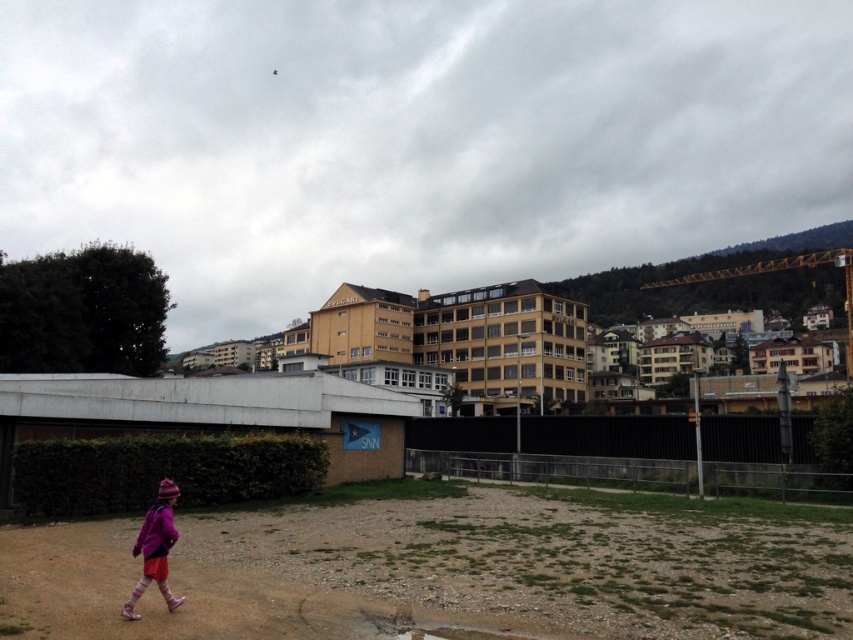
Who is lower down, brown gravel field at lower left or white concrete overpass at center?

brown gravel field at lower left is lower down.

Between point (234, 611) and point (328, 404), which one is positioned in front?

Point (234, 611) is in front.

I want to click on brown gravel field at lower left, so click(x=450, y=570).

Can you confirm if brown gravel field at lower left is bigger than pink woolen hat at lower left?

Yes.

Which is above, brown gravel field at lower left or pink woolen hat at lower left?

Positioned higher is pink woolen hat at lower left.

Is point (590, 502) in front of point (157, 573)?

No, it is behind (157, 573).

I want to click on brown gravel field at lower left, so click(x=450, y=570).

Is white concrete overpass at center closer to camera compared to pink woolen hat at lower left?

No.

Does white concrete overpass at center have a greater height compared to pink woolen hat at lower left?

Yes.

This screenshot has width=853, height=640. Describe the element at coordinates (198, 400) in the screenshot. I see `white concrete overpass at center` at that location.

Locate an element on the screen. The width and height of the screenshot is (853, 640). white concrete overpass at center is located at coordinates (198, 400).